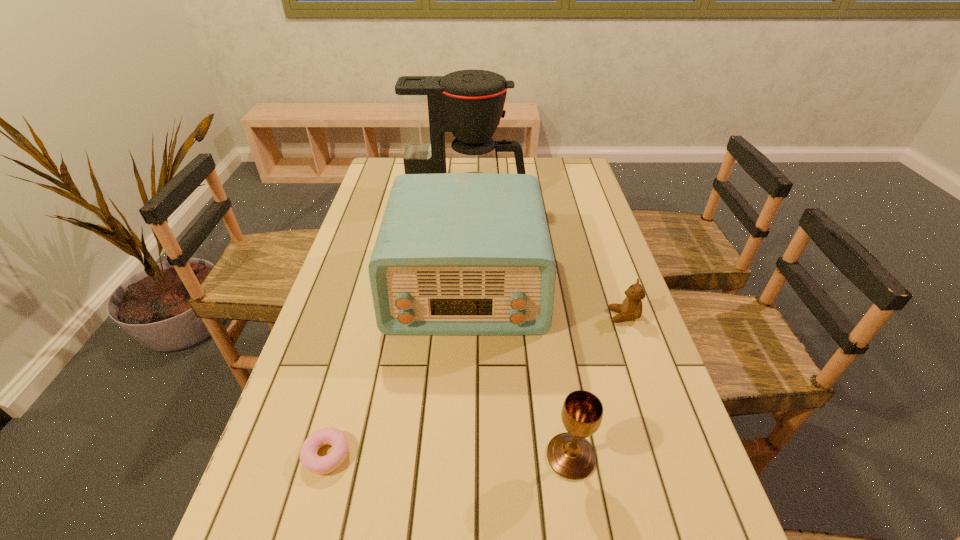
Point out which object is positioned as the second nearest to the second tallest object. Please provide its 2D coordinates. Your answer should be formatted as a tuple, i.e. [(x, y)], where the tuple contains the x and y coordinates of a point satisfying the conditions above.

[(469, 103)]

At what (x,y) coordinates should I click in order to perform the action: click on vacant space that satisfies the following two spatial constraints: 1. on the front-facing side of the teddy bear; 2. on the front side of the third tallest object. Please return your answer as a coordinate pair (x, y). This screenshot has height=540, width=960. Looking at the image, I should click on (671, 456).

I want to click on free space that satisfies the following two spatial constraints: 1. pour from the carafe of the third tallest object; 2. on the right side of the tallest object, so click(458, 456).

Identify the location of free space that satisfies the following two spatial constraints: 1. on the front panel of the second tallest object; 2. on the left side of the chalice. The image size is (960, 540). (460, 456).

Find the location of a particular element. The width and height of the screenshot is (960, 540). free location that satisfies the following two spatial constraints: 1. on the front panel of the third shortest object; 2. on the left side of the fourth shortest object is located at coordinates 460,456.

Locate an element on the screen. vacant point that satisfies the following two spatial constraints: 1. pour from the carafe of the farthest object; 2. on the left side of the chalice is located at coordinates (458, 456).

Find the location of a particular element. The image size is (960, 540). free space that satisfies the following two spatial constraints: 1. on the front-facing side of the second shortest object; 2. on the front side of the chalice is located at coordinates (671, 456).